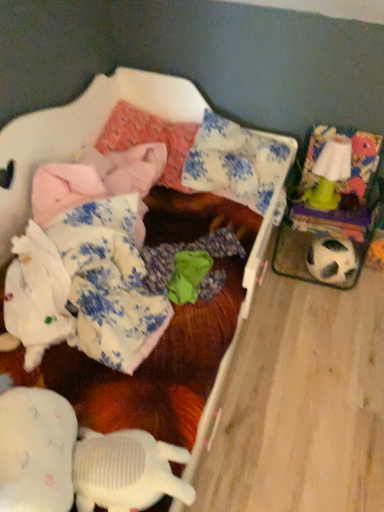
This screenshot has height=512, width=384. I want to click on free location above white plush toy at lower left (from a real-world perspective), so click(123, 465).